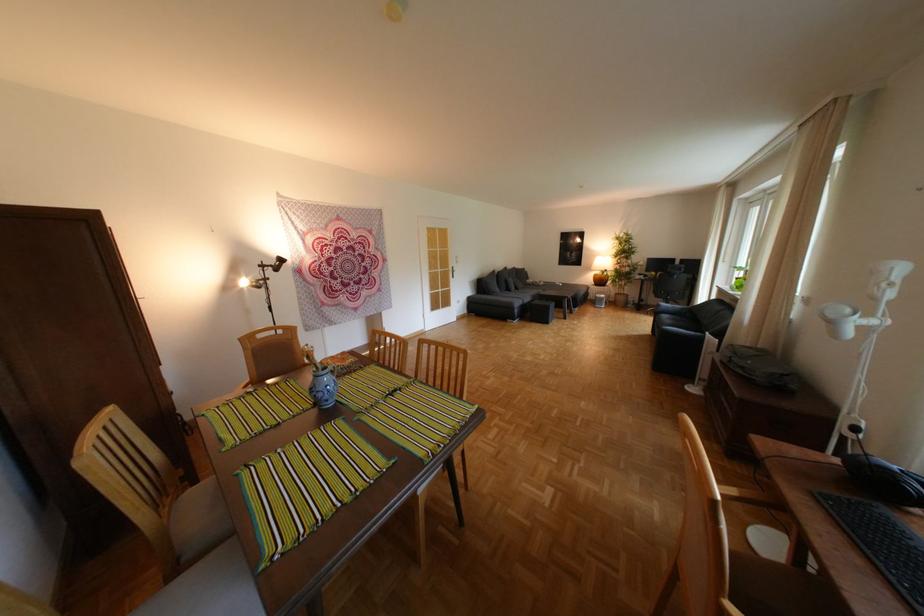
Identify the location of door handle. (444, 270).